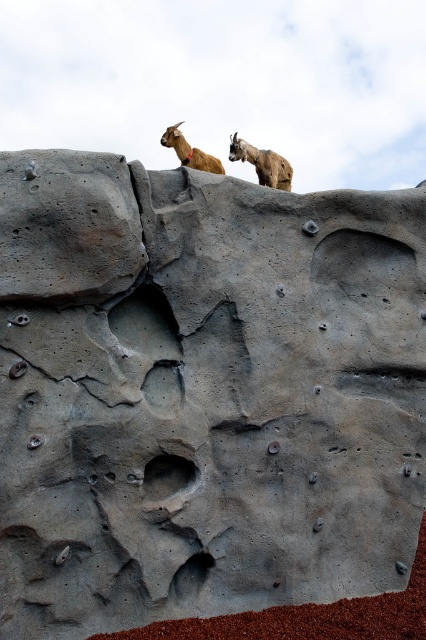
Does brown woolen goat at upper center appear under golden fur goat at upper center?

No, brown woolen goat at upper center is not below golden fur goat at upper center.

Is brown woolen goat at upper center positioned at the back of golden fur goat at upper center?

Yes.

Which is behind, point (241, 140) or point (207, 166)?

Point (241, 140)

Image resolution: width=426 pixels, height=640 pixels. I want to click on brown woolen goat at upper center, so click(262, 163).